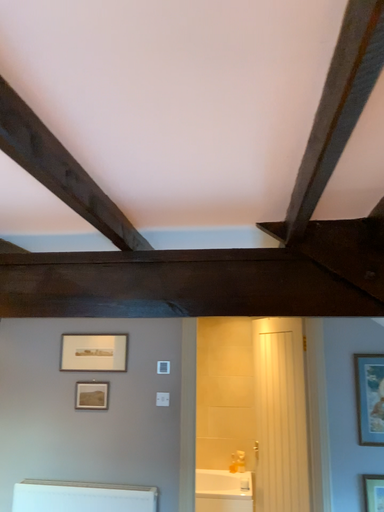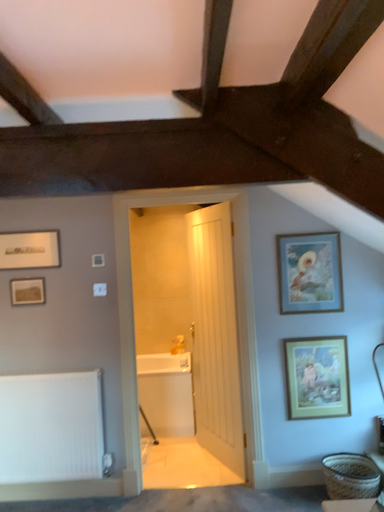
Question: How did the camera likely rotate when shooting the video?

Choices:
 (A) rotated left
 (B) rotated right

Answer: (B)